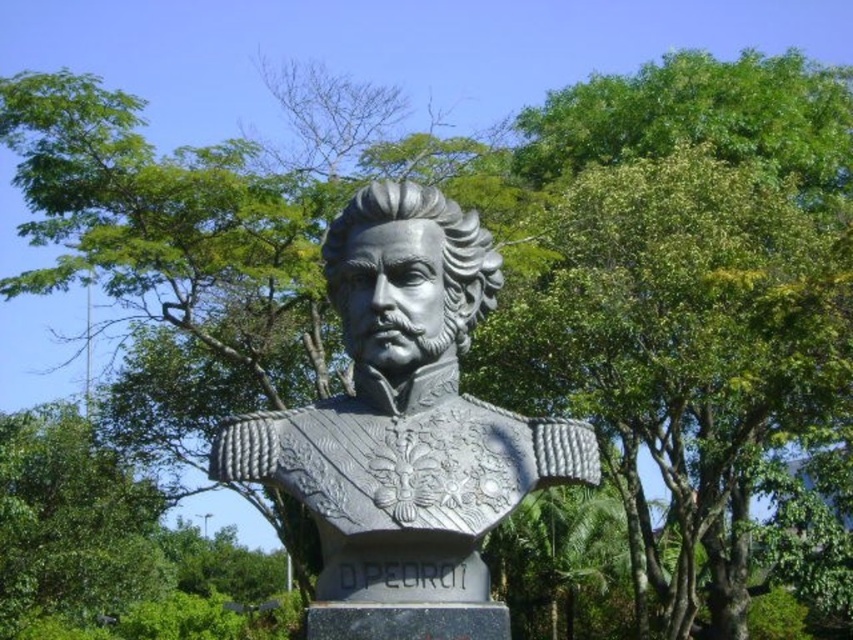
Question: Can you confirm if polished bronze bust at center is thinner than green leafy tree at center?

Choices:
 (A) yes
 (B) no

Answer: (A)

Question: Which point appears closest to the camera in this image?

Choices:
 (A) (438, 307)
 (B) (64, 424)

Answer: (A)

Question: Is polished bronze bust at center smaller than green leafy tree at center?

Choices:
 (A) yes
 (B) no

Answer: (A)

Question: Is polished bronze bust at center wider than green leafy tree at center?

Choices:
 (A) no
 (B) yes

Answer: (A)

Question: Which point is farther to the camera?

Choices:
 (A) (402, 515)
 (B) (120, 552)

Answer: (B)